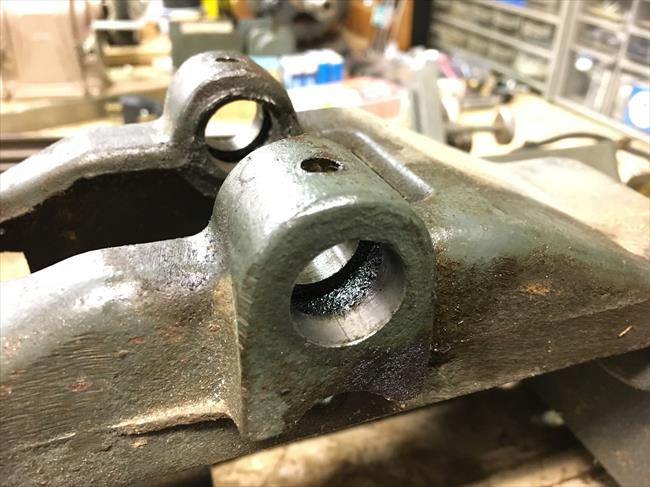
I want to click on square shelf containers, so click(x=623, y=86), click(x=580, y=82).